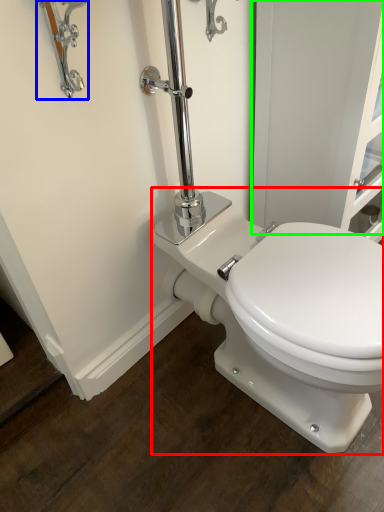
Question: Based on their relative distances, which object is farther from toilet (highlighted by a red box)? Choose from faucet (highlighted by a blue box) and screen door (highlighted by a green box).

Choices:
 (A) faucet
 (B) screen door

Answer: (A)